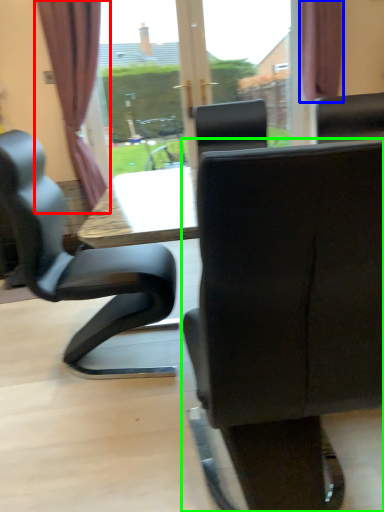
Question: Estimate the real-world distances between objects in this image. Which object is farther from curtain (highlighted by a red box), curtain (highlighted by a blue box) or chair (highlighted by a green box)?

Choices:
 (A) curtain
 (B) chair

Answer: (B)